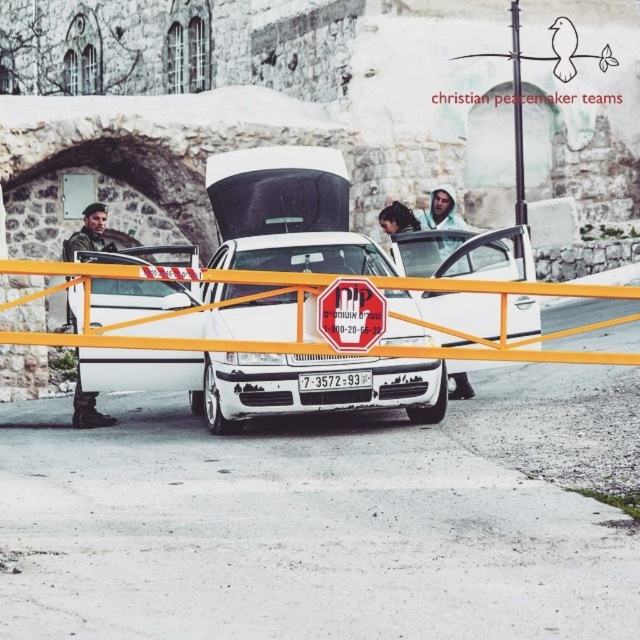
Which is more to the right, white glossy car at center or white plastic license plate at center?

white plastic license plate at center is more to the right.

Can you confirm if white glossy car at center is bigger than white plastic license plate at center?

Indeed, white glossy car at center has a larger size compared to white plastic license plate at center.

Is point (400, 300) less distant than point (356, 381)?

That is False.

The image size is (640, 640). I want to click on white glossy car at center, so click(288, 212).

Looking at this image, who is taller, red plastic stop sign at center or white plastic license plate at center?

red plastic stop sign at center

Between point (372, 288) and point (362, 385), which one is positioned in front?

Point (372, 288) is in front.

What do you see at coordinates (349, 314) in the screenshot? I see `red plastic stop sign at center` at bounding box center [349, 314].

Identify the location of red plastic stop sign at center. Image resolution: width=640 pixels, height=640 pixels. (349, 314).

Is camouflage fabric uniform at center positioned at the back of white plastic license plate at center?

Yes, camouflage fabric uniform at center is further from the viewer.

Find the location of a particular element. Image resolution: width=640 pixels, height=640 pixels. camouflage fabric uniform at center is located at coordinates (88, 232).

Is point (99, 230) more distant than point (348, 384)?

That is True.

Find the location of a particular element. camouflage fabric uniform at center is located at coordinates (88, 232).